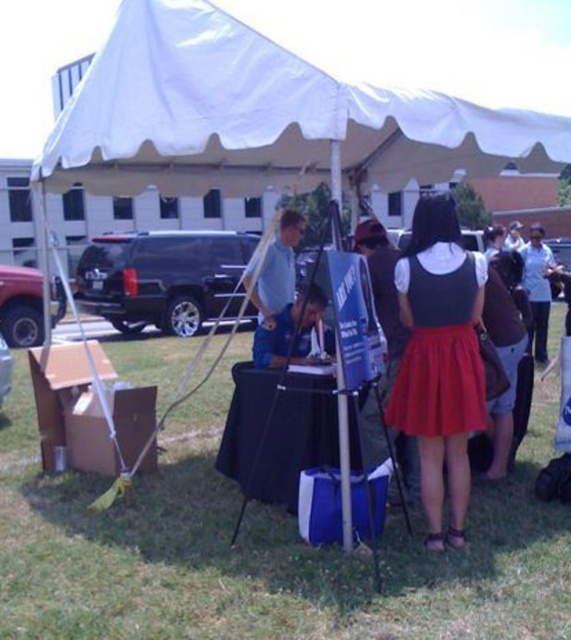
Does green grass at lower center have a lesser width compared to red satin dress at center?

Indeed, green grass at lower center has a lesser width compared to red satin dress at center.

Does green grass at lower center appear on the left side of red satin dress at center?

Incorrect, green grass at lower center is not on the left side of red satin dress at center.

Describe the element at coordinates (260, 550) in the screenshot. I see `green grass at lower center` at that location.

The image size is (571, 640). Identify the location of green grass at lower center. (260, 550).

Who is higher up, white fabric canopy at upper center or red satin dress at center?

white fabric canopy at upper center

Which is in front, point (297, 51) or point (444, 292)?

Point (444, 292) is more forward.

The height and width of the screenshot is (640, 571). What are the coordinates of `white fabric canopy at upper center` in the screenshot? It's located at (271, 112).

Is green grass at lower center below white fabric canopy at upper center?

Yes, green grass at lower center is below white fabric canopy at upper center.

The height and width of the screenshot is (640, 571). Find the location of `green grass at lower center`. green grass at lower center is located at coordinates (260, 550).